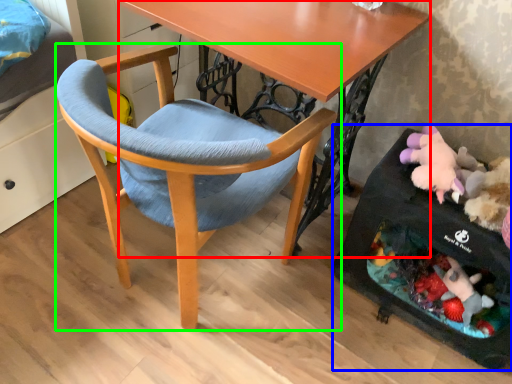
Question: Which object is positioned farthest from desk (highlighted by a red box)? Select from baby carriage (highlighted by a blue box) and chair (highlighted by a green box).

Choices:
 (A) baby carriage
 (B) chair

Answer: (A)